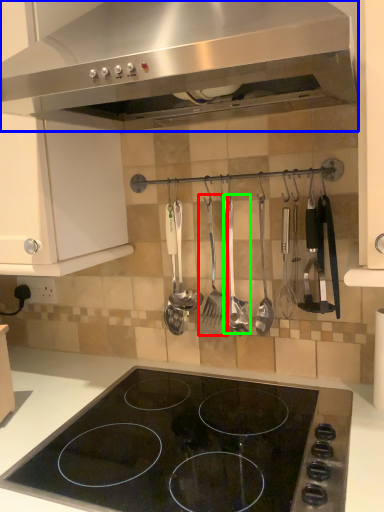
Question: Based on their relative distances, which object is farther from silverware (highlighted by a red box)? Choose from kitchen appliance (highlighted by a blue box) and silverware (highlighted by a green box).

Choices:
 (A) kitchen appliance
 (B) silverware

Answer: (A)